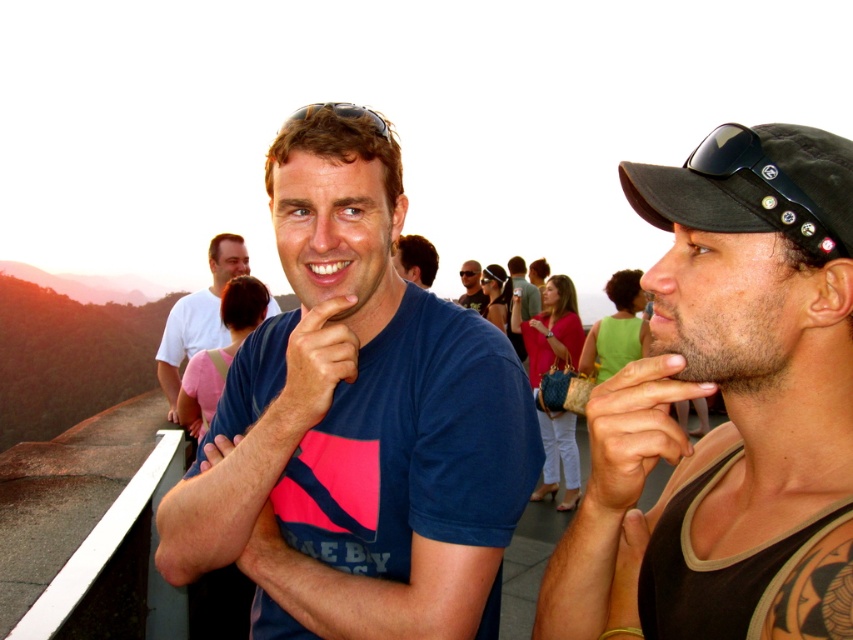
You are an observer looking at the scene. You notice the pink fabric hand at center and the hair at upper left. Which object is positioned higher in the image?

The pink fabric hand at center is positioned higher than the hair at upper left.